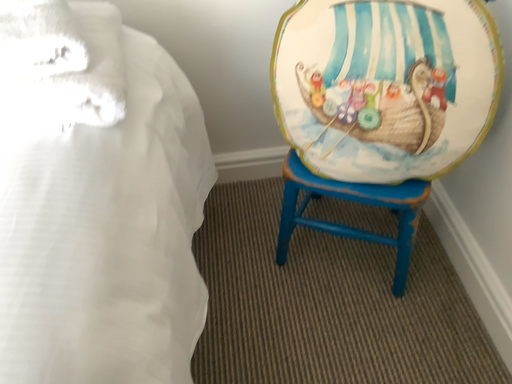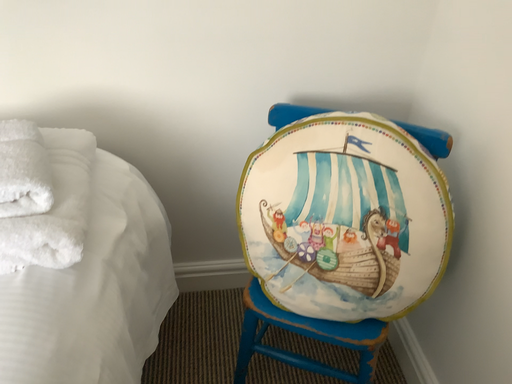
Question: Which way did the camera rotate in the video?

Choices:
 (A) rotated downward
 (B) rotated upward

Answer: (B)